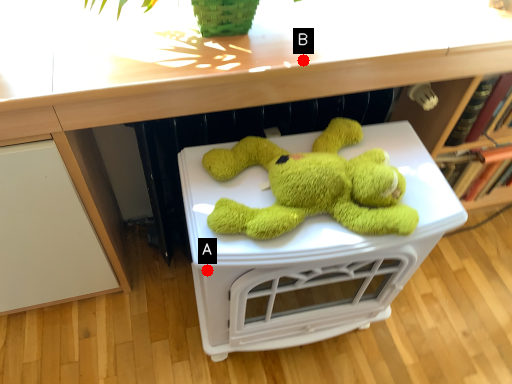
Question: Two points are circled on the image, labeled by A and B beside each circle. Which of the following is the closest to the observer?

Choices:
 (A) A is closer
 (B) B is closer

Answer: (A)